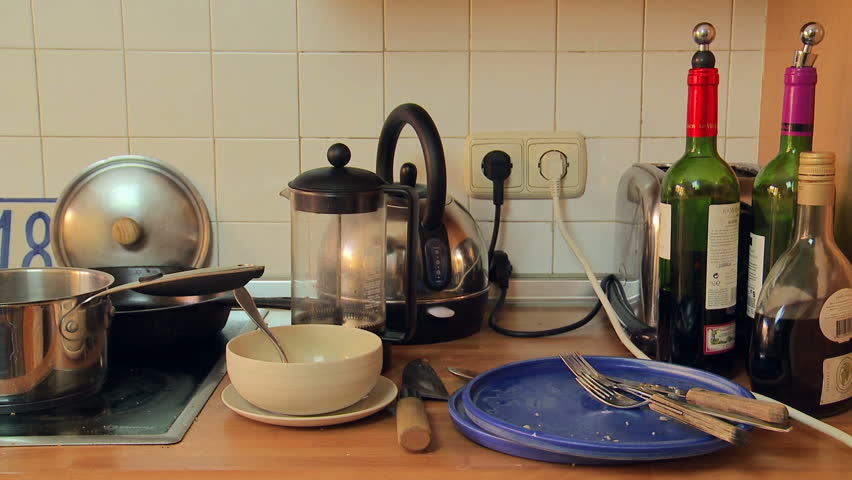
I want to click on plugs, so click(x=550, y=166), click(x=498, y=171).